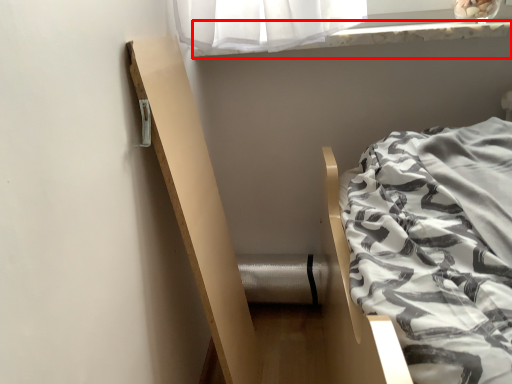
Question: Where is window sill (annotated by the red box) located in relation to balustrade in the image?

Choices:
 (A) right
 (B) left

Answer: (A)